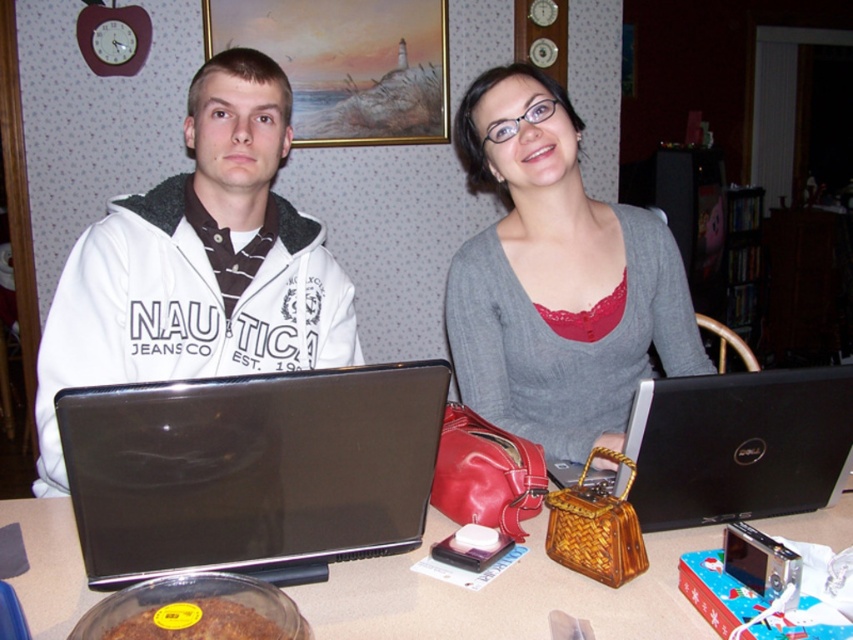
Between matte gray sweater at center and black matte laptop at right, which one is positioned higher?

Positioned higher is matte gray sweater at center.

Can you confirm if matte gray sweater at center is positioned to the right of black matte laptop at right?

In fact, matte gray sweater at center is to the left of black matte laptop at right.

Where is `matte gray sweater at center`? This screenshot has width=853, height=640. matte gray sweater at center is located at coordinates (556, 278).

Does black glossy laptop at center have a smaller size compared to smooth brown table at center?

Yes, black glossy laptop at center is smaller than smooth brown table at center.

Between black glossy laptop at center and smooth brown table at center, which one appears on the right side from the viewer's perspective?

smooth brown table at center

Identify the location of black glossy laptop at center. The height and width of the screenshot is (640, 853). (251, 468).

Is the position of matte gray sweater at center less distant than that of smooth brown table at center?

No.

Can you confirm if matte gray sweater at center is smaller than smooth brown table at center?

No.

The image size is (853, 640). What do you see at coordinates (556, 278) in the screenshot?
I see `matte gray sweater at center` at bounding box center [556, 278].

Identify the location of matte gray sweater at center. (556, 278).